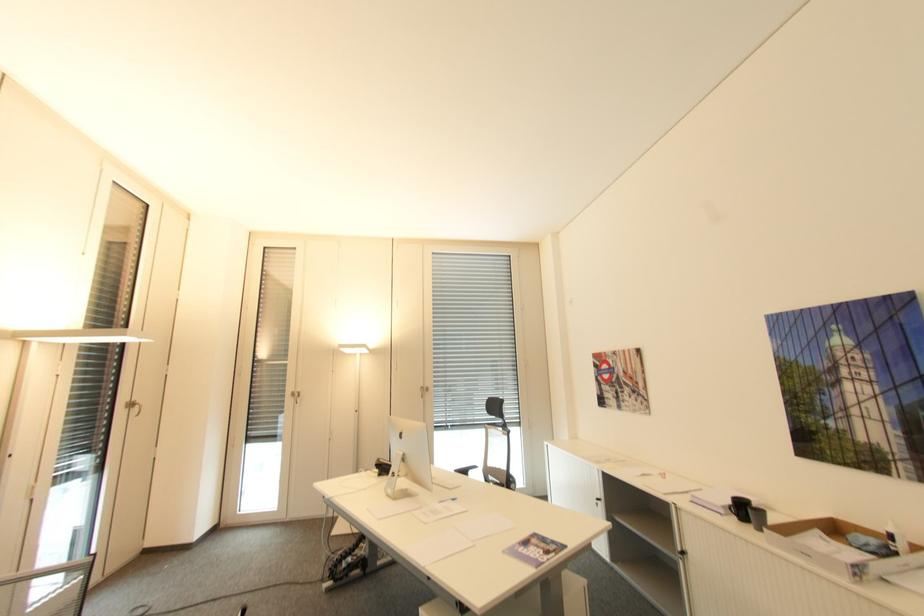
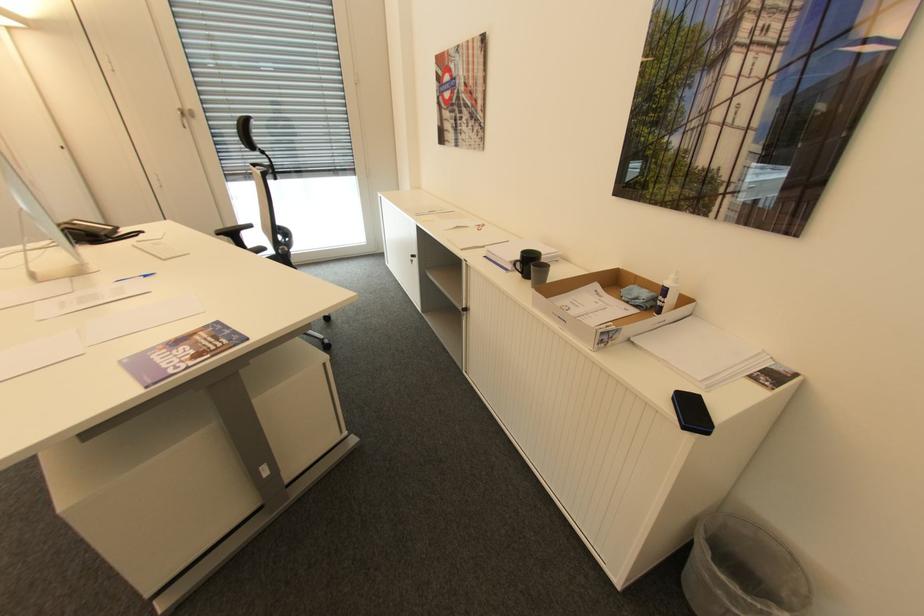
Locate, in the second image, the point that corresponds to (727,507) in the first image.

(516, 262)